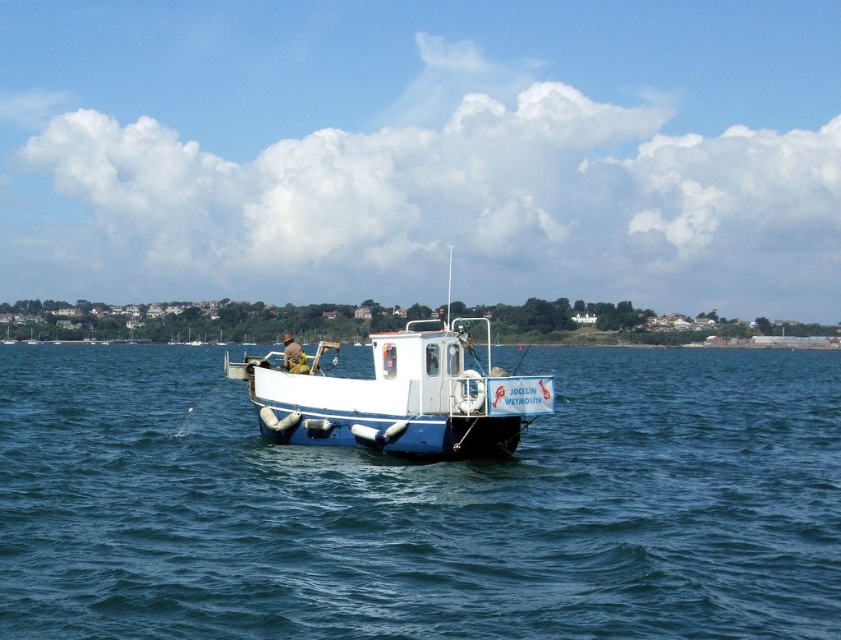
You are standing on the shore and see two boats in the water. The blue rubber boat at center and the white matte boat at center. Which boat is positioned to the left side from your perspective?

The blue rubber boat at center is positioned to the left of the white matte boat at center from your perspective.

You are on the fishing boat and want to move from the cabin door to the banner. Which point should you walk towards first, point (x=366, y=579) or point (x=262, y=413)?

You should walk towards point (x=366, y=579) first because it is in front of point (x=262, y=413), meaning it is closer to your current position at the cabin door.

You are an observer on a dock watching two boats in the water. You see the blue rubber boat at center and the white matte boat at center. Which boat is closer to you?

The blue rubber boat at center is closer to you because it is in front of the white matte boat at center.